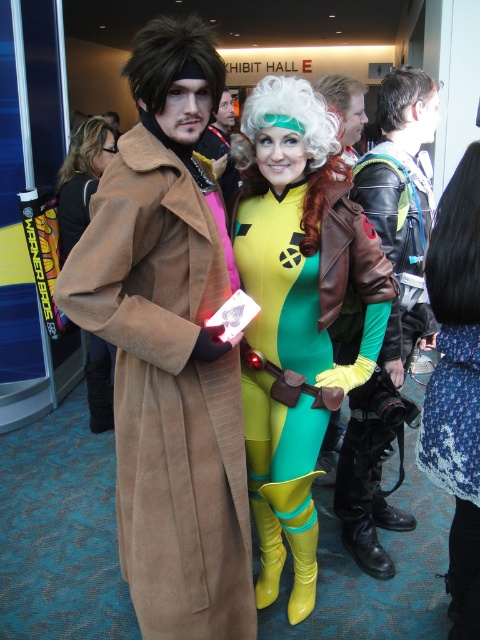
You are a photographer at the convention and need to position the green spandex suit at center and the white curly wig at upper center for a photo. According to the scene description, which object should be placed to the left side of the other?

The green spandex suit at center should be placed to the left of the white curly wig at upper center because the description states that the green spandex suit at center is to the left of the white curly wig at upper center.

You are a photographer at the convention and need to frame a shot that includes both the green spandex suit at center and the white curly wig at upper center. Given their sizes, which object should you ensure is positioned closer to the camera to maintain balance in the composition?

The green spandex suit at center is larger in size than the white curly wig at upper center, so to maintain balance in the composition, you should position the smaller white curly wig at upper center closer to the camera while keeping the larger green spandex suit at center further back.

You are standing in Exhibit Hall E and see the suede coat at left and the blue floral skirt at lower right. Which object is positioned more to the left side of the scene?

The suede coat at left is positioned more to the left side of the scene than the blue floral skirt at lower right.